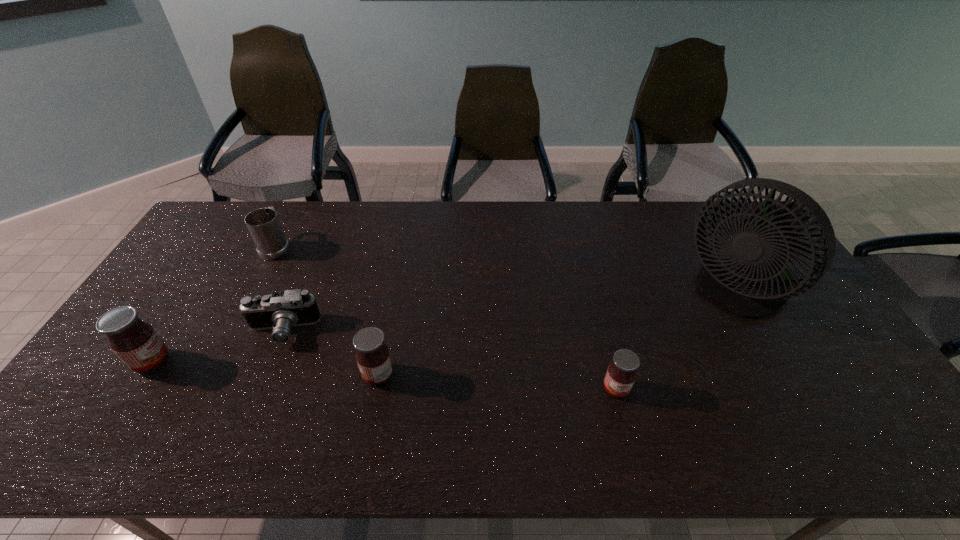
Find the location of `object present at the far edge`. object present at the far edge is located at coordinates [263, 224].

At what (x,y) coordinates should I click in order to perform the action: click on object that is at the left edge. Please return your answer as a coordinate pair (x, y). The image size is (960, 540). Looking at the image, I should click on (137, 344).

Image resolution: width=960 pixels, height=540 pixels. What are the coordinates of `object that is at the right edge` in the screenshot? It's located at (743, 282).

This screenshot has width=960, height=540. What are the coordinates of `free space at the far edge` in the screenshot? It's located at (533, 232).

Identify the location of blank area at the near edge. The width and height of the screenshot is (960, 540). (644, 384).

Image resolution: width=960 pixels, height=540 pixels. I want to click on free point at the left edge, so click(x=188, y=270).

This screenshot has width=960, height=540. In order to click on blank space at the right edge in this screenshot , I will do `click(820, 325)`.

Find the location of `free space at the far left corner of the desktop`. free space at the far left corner of the desktop is located at coordinates (208, 238).

Image resolution: width=960 pixels, height=540 pixels. Find the location of `empty space between the shortest object and the second jam from right to left`. empty space between the shortest object and the second jam from right to left is located at coordinates (330, 353).

This screenshot has height=540, width=960. Find the location of `vacant space in between the rightmost object and the mug`. vacant space in between the rightmost object and the mug is located at coordinates [507, 269].